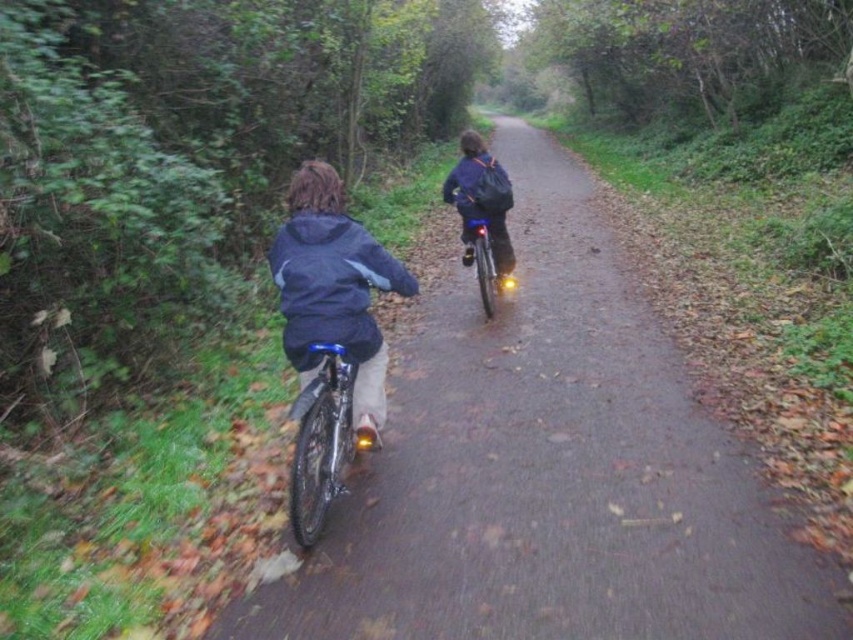
Is dark blue matte jacket at center taller than shiny metallic bicycle at center?

Incorrect, dark blue matte jacket at center's height is not larger of shiny metallic bicycle at center's.

Image resolution: width=853 pixels, height=640 pixels. I want to click on dark blue matte jacket at center, so click(331, 284).

Which is more to the right, matte blue bicycle at center or dark blue matte jacket at center?

matte blue bicycle at center is more to the right.

Can you confirm if matte blue bicycle at center is shorter than dark blue matte jacket at center?

In fact, matte blue bicycle at center may be taller than dark blue matte jacket at center.

Does point (403, 432) lie in front of point (294, 292)?

No, it is behind (294, 292).

Find the location of a particular element. The width and height of the screenshot is (853, 640). matte blue bicycle at center is located at coordinates (549, 468).

Consider the image. Is matte blue bicycle at center above shiny metallic bicycle at center?

Indeed, matte blue bicycle at center is positioned over shiny metallic bicycle at center.

Which of these two, matte blue bicycle at center or shiny metallic bicycle at center, stands shorter?

With less height is shiny metallic bicycle at center.

This screenshot has height=640, width=853. Describe the element at coordinates (549, 468) in the screenshot. I see `matte blue bicycle at center` at that location.

Locate an element on the screen. Image resolution: width=853 pixels, height=640 pixels. matte blue bicycle at center is located at coordinates (549, 468).